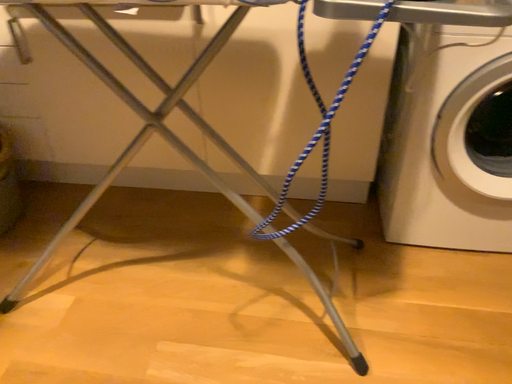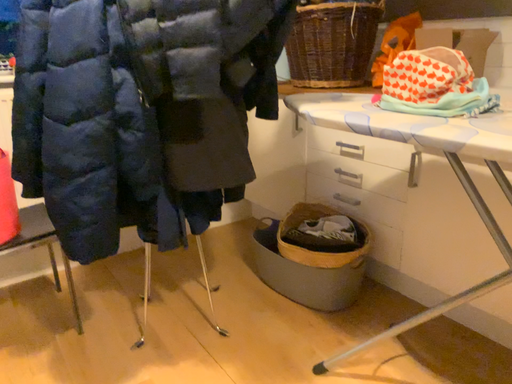
Question: Which way did the camera rotate in the video?

Choices:
 (A) rotated upward
 (B) rotated downward

Answer: (A)